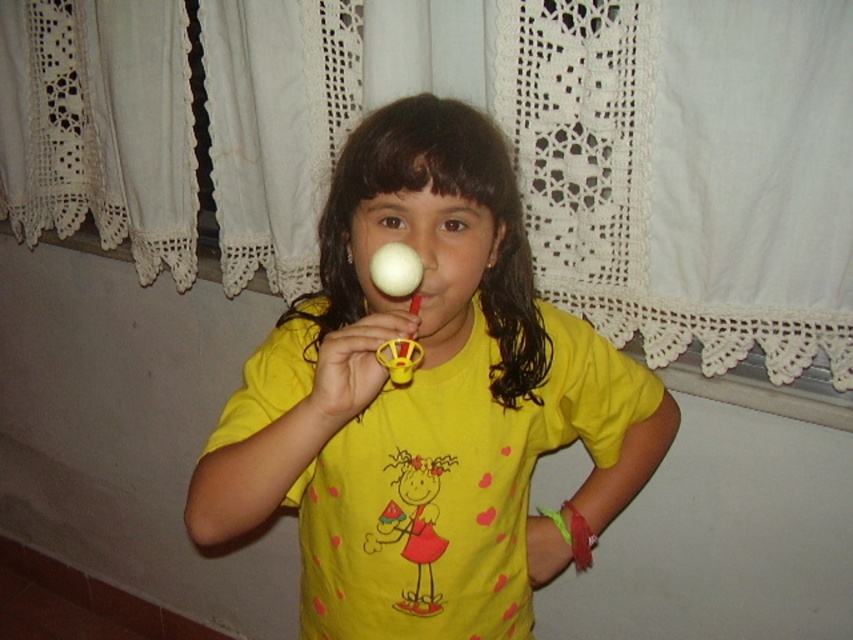
Question: Which object appears closest to the camera in this image?

Choices:
 (A) matte plastic rattle at center
 (B) yellow matte shirt at center

Answer: (A)

Question: Is yellow matte shirt at center smaller than matte plastic rattle at center?

Choices:
 (A) no
 (B) yes

Answer: (A)

Question: Is yellow matte shirt at center further to the viewer compared to matte plastic rattle at center?

Choices:
 (A) yes
 (B) no

Answer: (A)

Question: Is yellow matte shirt at center thinner than matte plastic rattle at center?

Choices:
 (A) no
 (B) yes

Answer: (A)